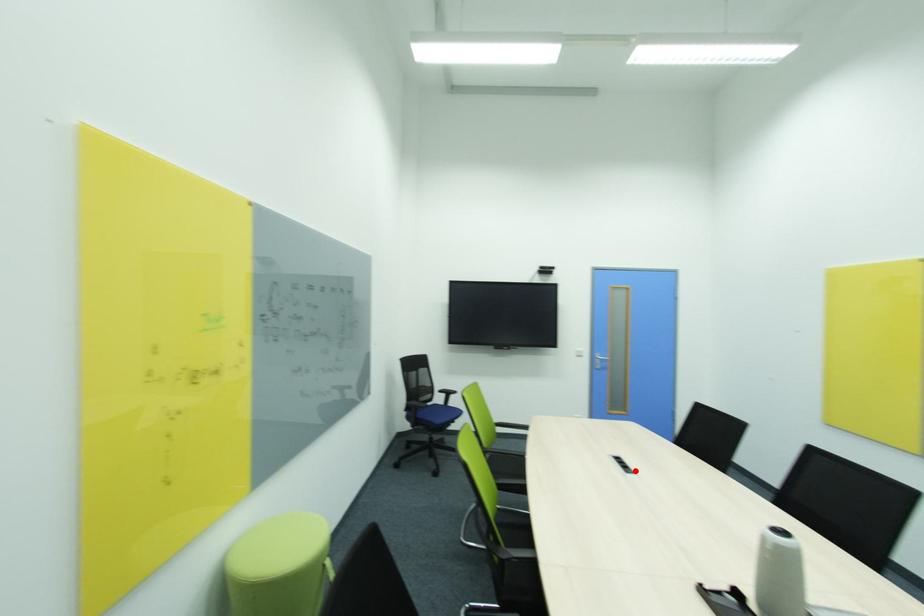
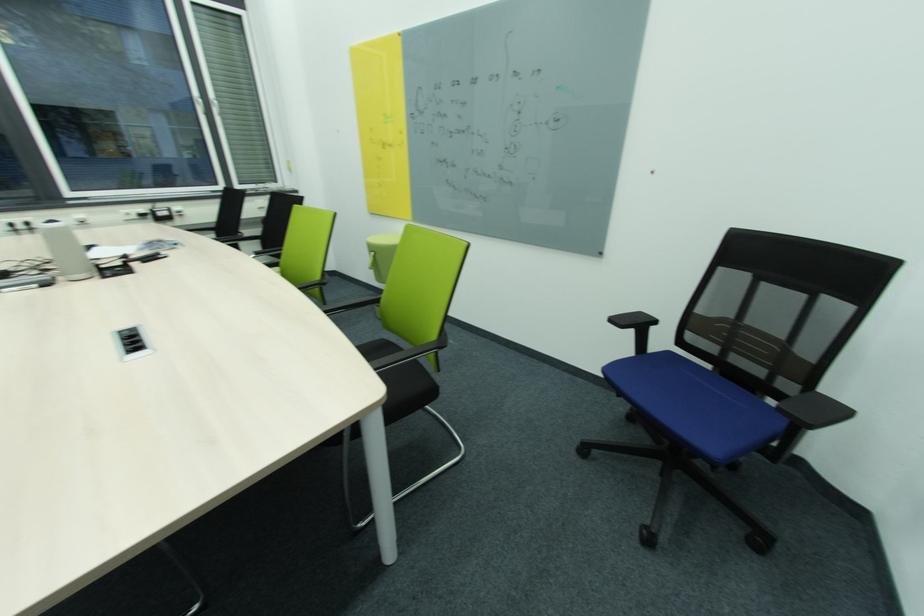
Find the pixel in the second image that matches the highlighted location in the first image.

(126, 338)